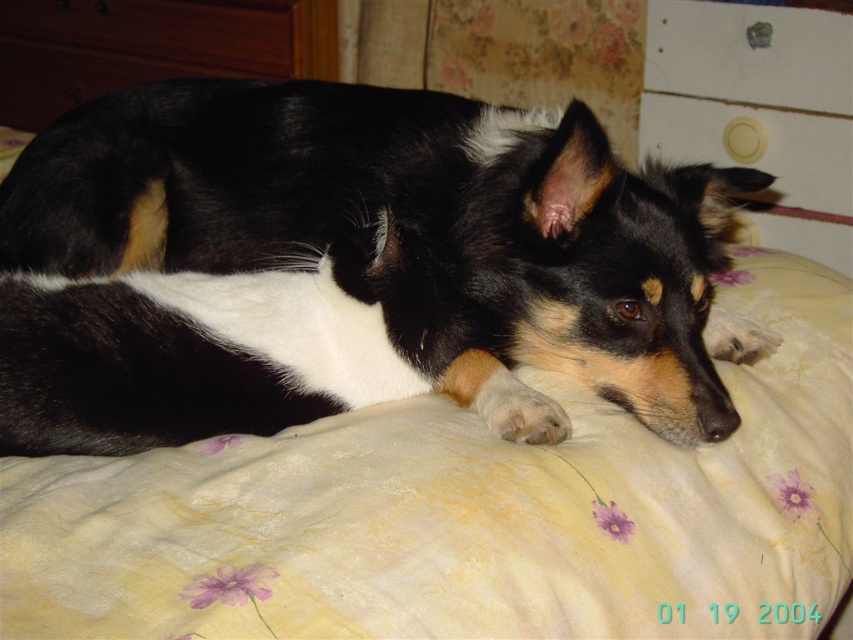
Does yellow floral fabric at center appear under black and white fur at center?

Correct, yellow floral fabric at center is located below black and white fur at center.

Between point (514, 636) and point (421, 147), which one is positioned in front?

Point (514, 636) is in front.

The width and height of the screenshot is (853, 640). I want to click on yellow floral fabric at center, so [467, 513].